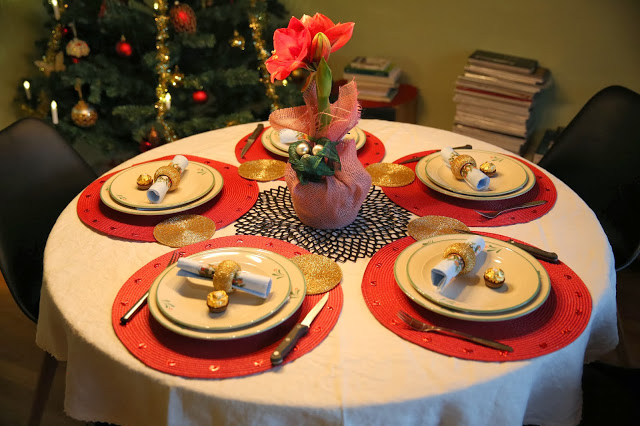
Image resolution: width=640 pixels, height=426 pixels. Find the location of `rolled up white napkins`. rolled up white napkins is located at coordinates (473, 176), (447, 269), (255, 277), (161, 190).